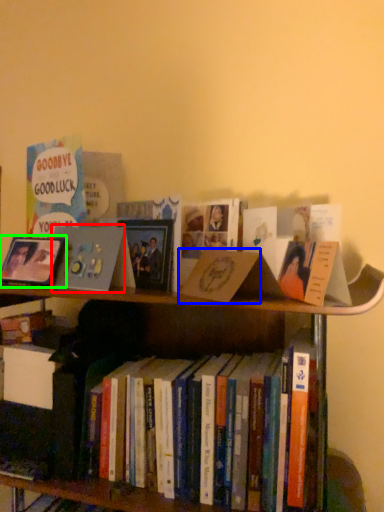
Question: Considering the real-world distances, which object is farthest from book cover (highlighted by a red box)? paperback book (highlighted by a blue box) or picture frame (highlighted by a green box)?

Choices:
 (A) paperback book
 (B) picture frame

Answer: (A)